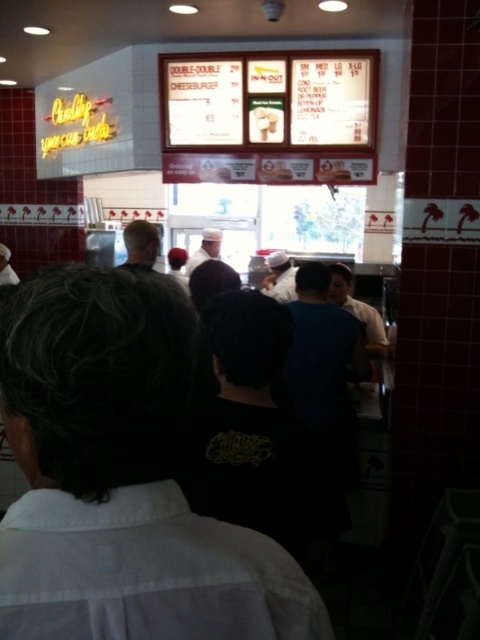
You are a customer at In N Out Burger and you see two black shirts at the center of the counter area. The staff member wearing the black shirt at center is standing next to another staff member wearing the black fabric shirt at center. Which staff member has a wider shirt?

The black shirt at center has a greater width than the black fabric shirt at center.